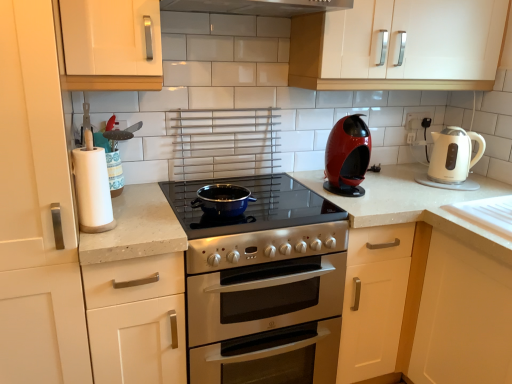
Question: Considering the relative positions of white glossy cabinet at upper center, which ranks as the first cabinetry in right-to-left order, and white matte paper towel at left in the image provided, is white glossy cabinet at upper center, which ranks as the first cabinetry in right-to-left order, to the right of white matte paper towel at left from the viewer's perspective?

Choices:
 (A) yes
 (B) no

Answer: (A)

Question: Is white glossy cabinet at upper center, acting as the fourth cabinetry starting from the left, looking in the opposite direction of white matte paper towel at left?

Choices:
 (A) no
 (B) yes

Answer: (A)

Question: From a real-world perspective, is white glossy cabinet at upper center, acting as the fourth cabinetry starting from the left, located higher than white matte paper towel at left?

Choices:
 (A) yes
 (B) no

Answer: (A)

Question: Can you confirm if white glossy cabinet at upper center, which ranks as the first cabinetry in right-to-left order, is shorter than white matte paper towel at left?

Choices:
 (A) no
 (B) yes

Answer: (A)

Question: Can you confirm if white glossy cabinet at upper center, which ranks as the first cabinetry in right-to-left order, is positioned to the left of white matte paper towel at left?

Choices:
 (A) yes
 (B) no

Answer: (B)

Question: From a real-world perspective, relative to red glossy coffee machine at center right, the first kitchen appliance in the left-to-right sequence, is white matte paper towel at left vertically above or below?

Choices:
 (A) below
 (B) above

Answer: (B)

Question: Looking at their shapes, would you say white matte paper towel at left is wider or thinner than red glossy coffee machine at center right, the first kitchen appliance in the left-to-right sequence?

Choices:
 (A) thin
 (B) wide

Answer: (A)

Question: Do you think white matte paper towel at left is within red glossy coffee machine at center right, the first kitchen appliance in the left-to-right sequence, or outside of it?

Choices:
 (A) outside
 (B) inside

Answer: (A)

Question: Considering the positions of white matte paper towel at left and red glossy coffee machine at center right, the 2th kitchen appliance from the right, in the image, is white matte paper towel at left taller or shorter than red glossy coffee machine at center right, the 2th kitchen appliance from the right,?

Choices:
 (A) short
 (B) tall

Answer: (A)

Question: Choose the correct answer: Is white matte cabinet at left, the 4th cabinetry positioned from the right, inside white glossy electric kettle at right, placed as the 1th kitchen appliance when sorted from right to left, or outside it?

Choices:
 (A) inside
 (B) outside

Answer: (B)

Question: Based on their positions, is white matte cabinet at left, the 4th cabinetry positioned from the right, located to the left or right of white glossy electric kettle at right, placed as the 1th kitchen appliance when sorted from right to left?

Choices:
 (A) left
 (B) right

Answer: (A)

Question: Is point (17, 168) closer or farther from the camera than point (445, 135)?

Choices:
 (A) closer
 (B) farther

Answer: (A)

Question: Is white matte cabinet at left, positioned as the 1th cabinetry in left-to-right order, bigger or smaller than white glossy electric kettle at right, placed as the 1th kitchen appliance when sorted from right to left?

Choices:
 (A) small
 (B) big

Answer: (B)

Question: Is white matte cabinet handle at upper left, positioned as the 3th cabinetry in right-to-left order, wider or thinner than white plastic electric outlet at upper right?

Choices:
 (A) wide
 (B) thin

Answer: (A)

Question: Based on their sizes in the image, would you say white matte cabinet handle at upper left, marked as the 2th cabinetry in a left-to-right arrangement, is bigger or smaller than white plastic electric outlet at upper right?

Choices:
 (A) big
 (B) small

Answer: (A)